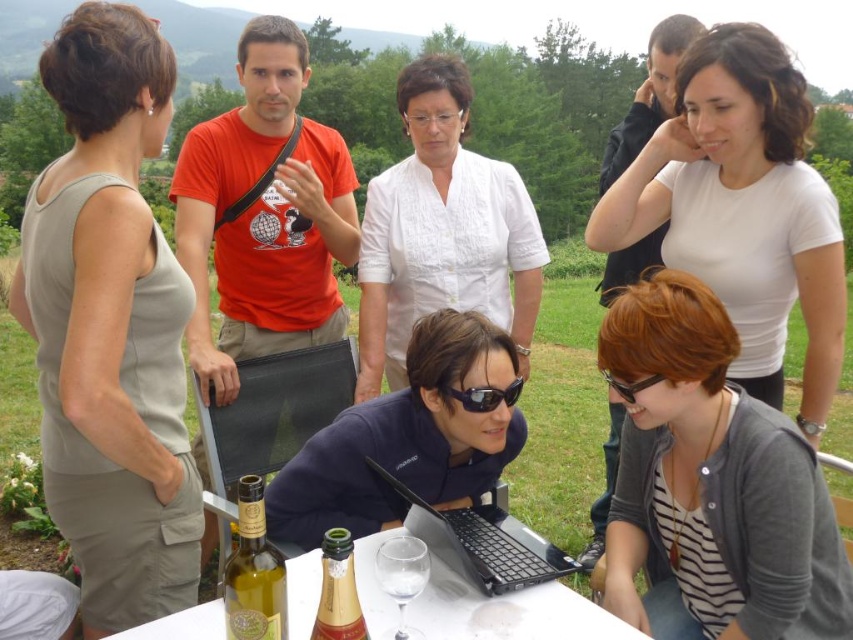
Can you confirm if white cotton blouse at center is thinner than clear glass wine glass at lower center?

No.

Is point (416, 131) farther from viewer compared to point (390, 547)?

Yes, it is.

I want to click on white cotton blouse at center, so click(x=442, y=230).

Is point (325, 582) positioned after point (404, 541)?

No.

Who is lower down, gold foil champagne bottle at center or clear glass wine glass at lower center?

clear glass wine glass at lower center is lower down.

Does point (350, 563) lie behind point (427, 552)?

No, (350, 563) is closer to viewer.

What are the coordinates of `gold foil champagne bottle at center` in the screenshot? It's located at (338, 589).

Which is above, matte beige dress at left or black plastic goggles at lower center?

black plastic goggles at lower center

I want to click on matte beige dress at left, so click(111, 326).

The image size is (853, 640). I want to click on matte beige dress at left, so click(x=111, y=326).